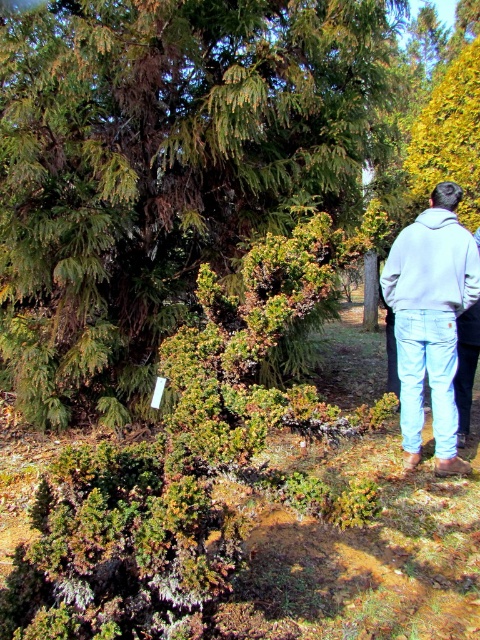
Between green leafy tree at upper left and sweatshirt at right, which one is positioned higher?

green leafy tree at upper left is above.

Does green leafy tree at upper left have a lesser height compared to sweatshirt at right?

No, green leafy tree at upper left is not shorter than sweatshirt at right.

This screenshot has height=640, width=480. Identify the location of green leafy tree at upper left. (164, 168).

Where is `green leafy tree at upper left`? The height and width of the screenshot is (640, 480). green leafy tree at upper left is located at coordinates (164, 168).

Between green leafy tree at upper left and light gray hoodie at upper right, which one is positioned lower?

light gray hoodie at upper right

What do you see at coordinates (164, 168) in the screenshot? I see `green leafy tree at upper left` at bounding box center [164, 168].

Where is `green leafy tree at upper left`? This screenshot has width=480, height=640. green leafy tree at upper left is located at coordinates (164, 168).

Is green leafy tree at upper left bigger than green textured bush at center?

Correct, green leafy tree at upper left is larger in size than green textured bush at center.

Between green leafy tree at upper left and green textured bush at center, which one appears on the left side from the viewer's perspective?

From the viewer's perspective, green leafy tree at upper left appears more on the left side.

Who is more distant from viewer, [98,369] or [78,595]?

The point [98,369] is behind.

Locate an element on the screen. The width and height of the screenshot is (480, 640). green leafy tree at upper left is located at coordinates (164, 168).